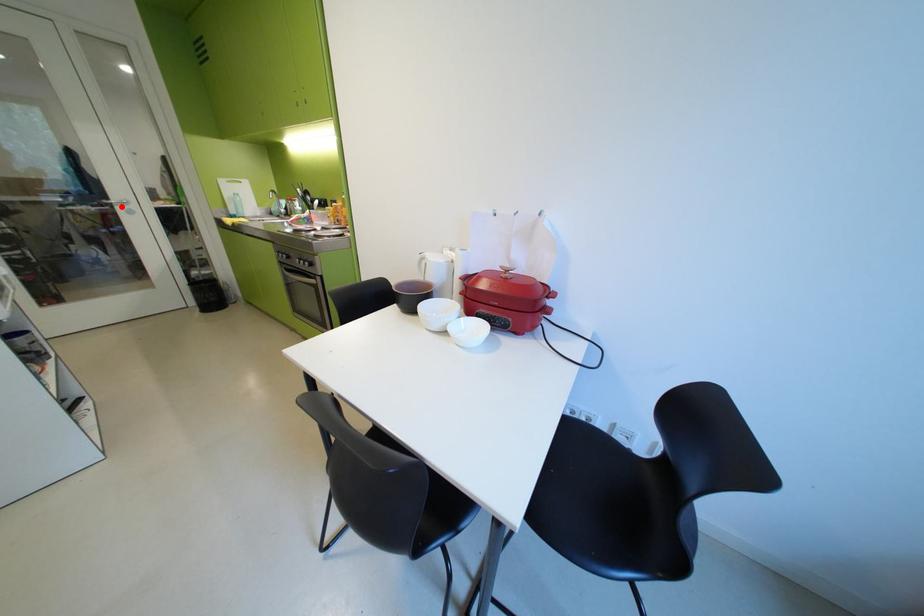
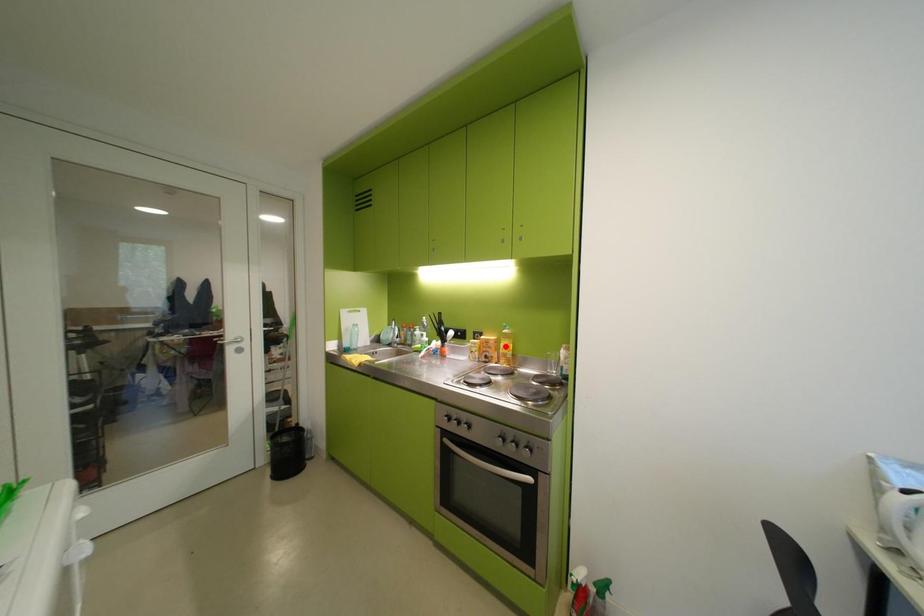
I am providing you with two images of the same scene from different viewpoints. A red point is marked on the first image and another point is marked on the second image. Do the highlighted points in image1 and image2 indicate the same real-world spot?

No